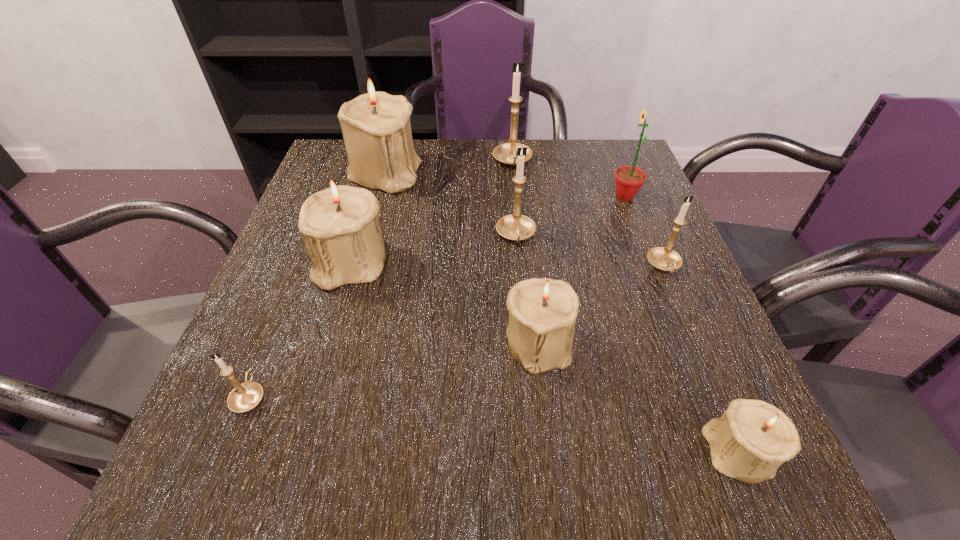
Find the location of `free spot between the third biggest beige candle_holder and the third biggest gold candle holder`. free spot between the third biggest beige candle_holder and the third biggest gold candle holder is located at coordinates (601, 304).

At what (x,y) coordinates should I click in order to perform the action: click on unoccupied area between the sunflower and the second smallest gold candle holder. Please return your answer as a coordinate pair (x, y). This screenshot has width=960, height=540. Looking at the image, I should click on (644, 231).

The image size is (960, 540). I want to click on vacant space in between the nearest object and the biggest gold candle holder, so tap(625, 307).

Find the location of a particular element. Image resolution: width=960 pixels, height=540 pixels. empty location between the third nearest candle_holder and the biggest gold candle holder is located at coordinates (525, 252).

Locate which object ranks in proximity to the third smallest gold candle holder. Please provide its 2D coordinates. Your answer should be formatted as a tuple, i.e. [(x, y)], where the tuple contains the x and y coordinates of a point satisfying the conditions above.

[(542, 311)]

Identify the location of object that can be found as the third closest to the third farthest beige candle_holder. This screenshot has height=540, width=960. (663, 258).

Identify the location of candle_holder identified as the sixth closest to the farthest beige candle_holder. The image size is (960, 540). (663, 258).

Locate an element on the screen. The width and height of the screenshot is (960, 540). candle_holder that is the closest to the biggest beige candle_holder is located at coordinates (340, 227).

You are a GUI agent. You are given a task and a screenshot of the screen. Output one action in this format:
    pyautogui.click(x=<x>, y=<y>)
    Task: Click on the gold candle holder that is the fourth closest to the smallest beige candle_holder
    
    Given the screenshot: What is the action you would take?
    [505, 153]

Where is `the third closest gold candle holder to the third smallest beige candle_holder`? the third closest gold candle holder to the third smallest beige candle_holder is located at coordinates (505, 153).